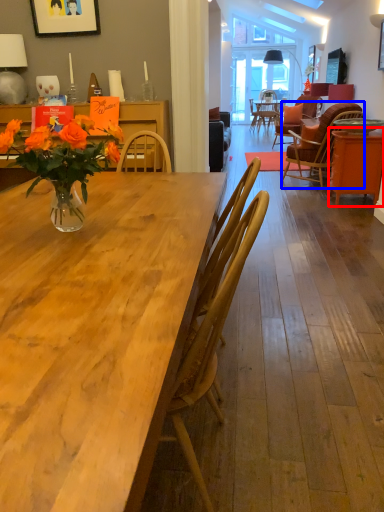
Question: Which of the following is the farthest to the observer, table (highlighted by a red box) or chair (highlighted by a blue box)?

Choices:
 (A) table
 (B) chair

Answer: (B)